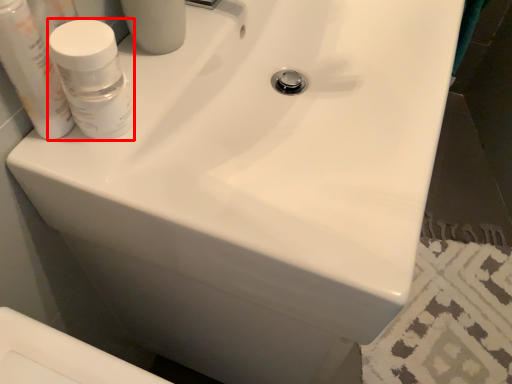
Question: From the image's perspective, where is mouthwash (annotated by the red box) located in relation to mouthwash in the image?

Choices:
 (A) below
 (B) above

Answer: (A)